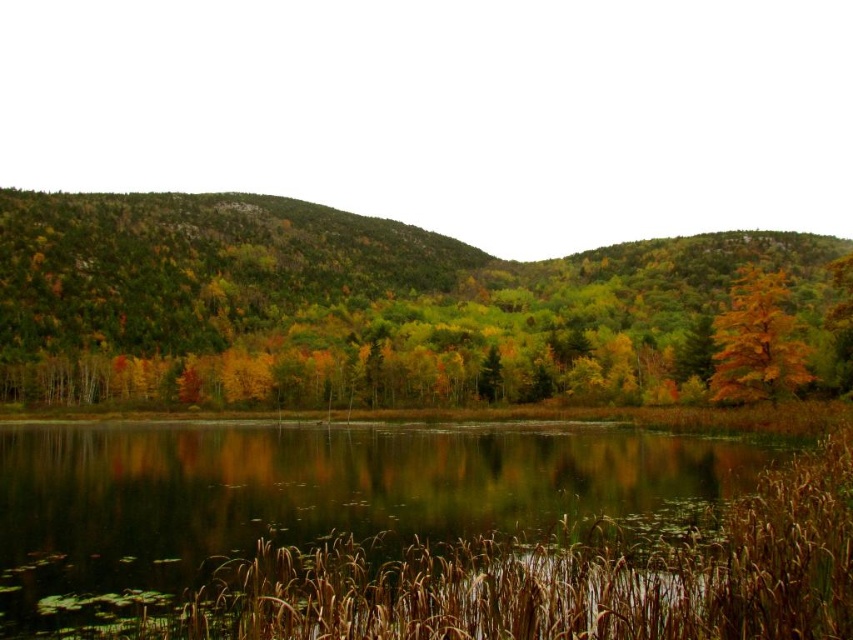
Does point (744, 572) lie behind point (726, 323)?

No, it is in front of (726, 323).

Can you confirm if brown grass at lower center is thinner than yellow matte tree at right?

Yes.

Is point (438, 560) farther from viewer compared to point (795, 381)?

No, it is not.

Identify the location of brown grass at lower center. The height and width of the screenshot is (640, 853). (563, 579).

Is yellow-green foliage at center in front of brown grass at lower center?

No, it is behind brown grass at lower center.

Is point (360, 236) positioned in front of point (717, 547)?

No, it is behind (717, 547).

At what (x,y) coordinates should I click in order to perform the action: click on yellow-green foliage at center. Please return your answer as a coordinate pair (x, y). Image resolution: width=853 pixels, height=640 pixels. Looking at the image, I should click on (363, 307).

Is point (293, 316) closer to camera compared to point (788, 282)?

Yes.

The width and height of the screenshot is (853, 640). Identify the location of yellow-green foliage at center. (363, 307).